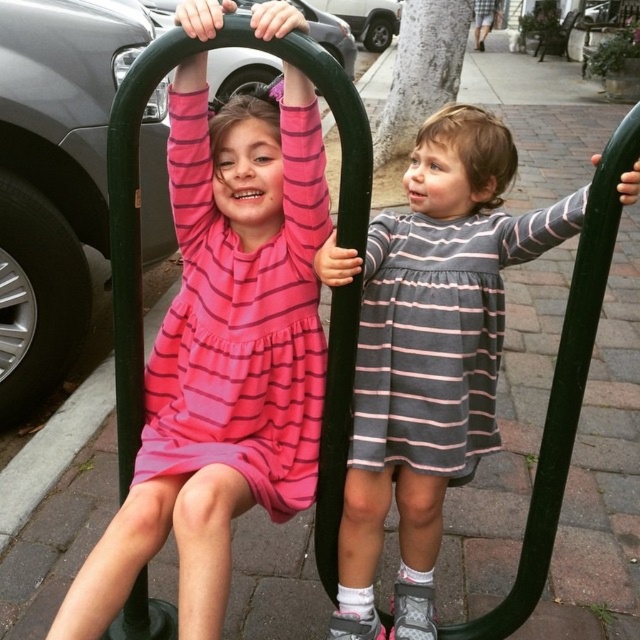
Question: Can you confirm if pink striped dress at upper left is positioned to the right of gray striped dress at center?

Choices:
 (A) no
 (B) yes

Answer: (A)

Question: Which point appears farthest from the camera in this image?

Choices:
 (A) (216, 285)
 (B) (595, 221)

Answer: (A)

Question: Does pink striped dress at upper left have a lesser width compared to gray striped dress at center?

Choices:
 (A) yes
 (B) no

Answer: (A)

Question: Is pink striped dress at upper left smaller than gray striped dress at center?

Choices:
 (A) no
 (B) yes

Answer: (B)

Question: Which point is closer to the camera?

Choices:
 (A) (176, 349)
 (B) (358, 509)

Answer: (B)